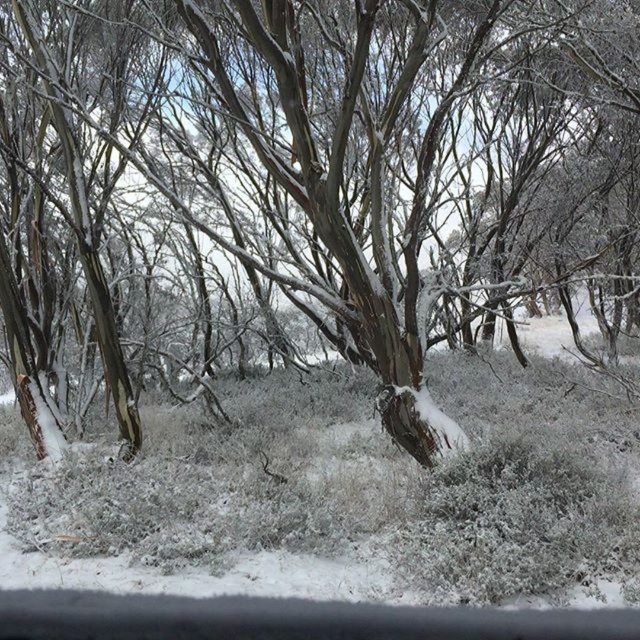
Can you confirm if smooth bark tree at center is bigger than white fluffy grass at center?

Correct, smooth bark tree at center is larger in size than white fluffy grass at center.

Is point (440, 97) positioned behind point (612, 513)?

Yes, it is.

Does point (381, 28) come farther from viewer compared to point (600, 420)?

Yes, it is.

Identify the location of smooth bark tree at center. The height and width of the screenshot is (640, 640). (346, 157).